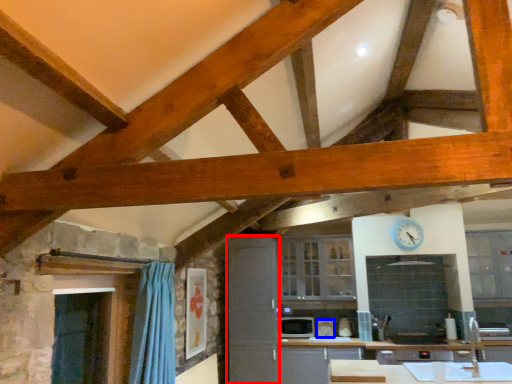
Question: Which point is further to the camera, cabinetry (highlighted by a red box) or appliance (highlighted by a blue box)?

Choices:
 (A) cabinetry
 (B) appliance

Answer: (B)